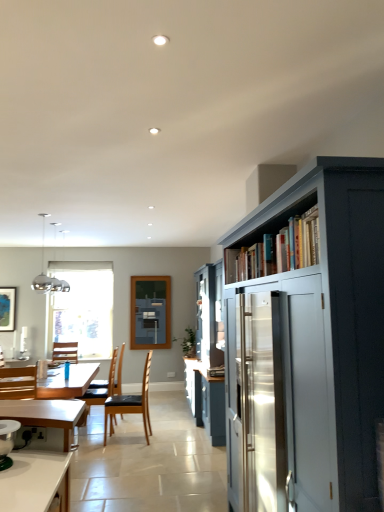
Question: Can you confirm if matte gray cupboard at right is shorter than blue fabric at center?

Choices:
 (A) yes
 (B) no

Answer: (B)

Question: Can you confirm if matte gray cupboard at right is thinner than blue fabric at center?

Choices:
 (A) no
 (B) yes

Answer: (A)

Question: Is matte gray cupboard at right positioned behind blue fabric at center?

Choices:
 (A) no
 (B) yes

Answer: (A)

Question: Can you confirm if matte gray cupboard at right is wider than blue fabric at center?

Choices:
 (A) yes
 (B) no

Answer: (A)

Question: Are matte gray cupboard at right and blue fabric at center far apart?

Choices:
 (A) yes
 (B) no

Answer: (A)

Question: Is matte gray cupboard at right spatially inside black leather chair at center, the 2th chair from the front, or outside of it?

Choices:
 (A) outside
 (B) inside

Answer: (A)

Question: From the image's perspective, is matte gray cupboard at right positioned above or below black leather chair at center, the fourth chair when ordered from left to right?

Choices:
 (A) below
 (B) above

Answer: (B)

Question: Is point (264, 231) closer or farther from the camera than point (147, 403)?

Choices:
 (A) farther
 (B) closer

Answer: (B)

Question: In terms of height, does matte gray cupboard at right look taller or shorter compared to black leather chair at center, positioned as the 1th chair in right-to-left order?

Choices:
 (A) tall
 (B) short

Answer: (A)

Question: From the image's perspective, relative to blue fabric at center, is white painted wood bookshelf at upper right above or below?

Choices:
 (A) above
 (B) below

Answer: (A)

Question: Would you say white painted wood bookshelf at upper right is inside or outside blue fabric at center?

Choices:
 (A) outside
 (B) inside

Answer: (A)

Question: In terms of width, does white painted wood bookshelf at upper right look wider or thinner when compared to blue fabric at center?

Choices:
 (A) thin
 (B) wide

Answer: (B)

Question: Relative to blue fabric at center, is white painted wood bookshelf at upper right in front or behind?

Choices:
 (A) behind
 (B) front

Answer: (B)

Question: From the image's perspective, is black leather chair at center, positioned as the 1th chair in right-to-left order, positioned above or below matte gray cupboard at right?

Choices:
 (A) below
 (B) above

Answer: (A)

Question: From a real-world perspective, is black leather chair at center, positioned as the 1th chair in right-to-left order, positioned above or below matte gray cupboard at right?

Choices:
 (A) below
 (B) above

Answer: (A)